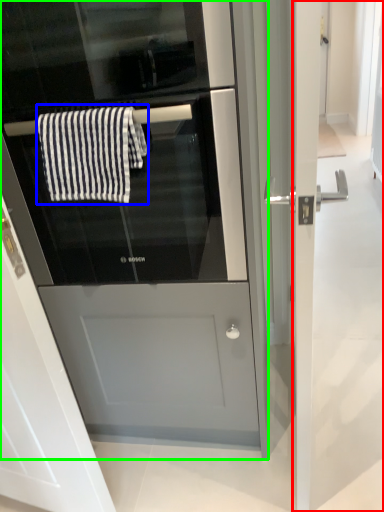
Question: Which is nearer to the screen door (highlighted by a red box)? bath towel (highlighted by a blue box) or fridge (highlighted by a green box).

Choices:
 (A) bath towel
 (B) fridge

Answer: (B)